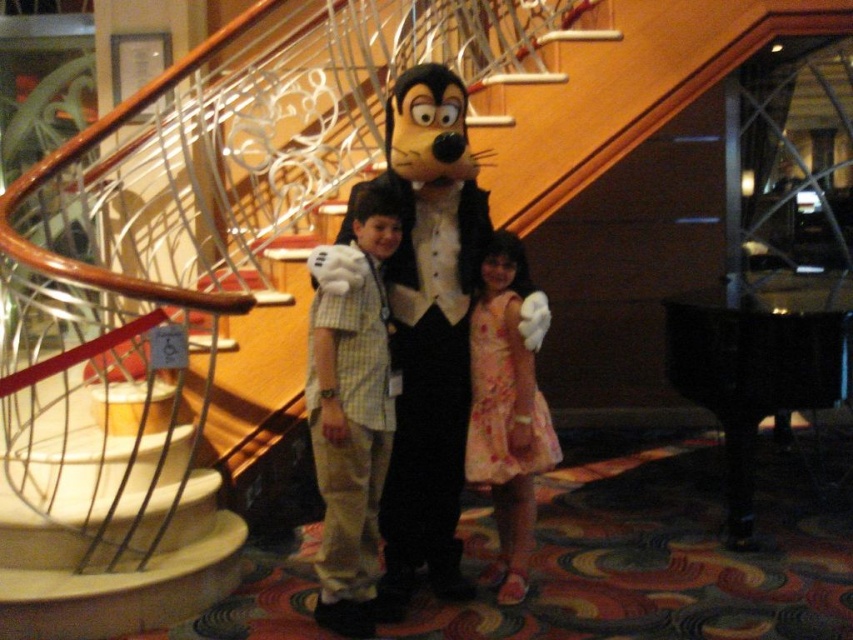
Question: Does light brown cotton pants at center have a larger size compared to floral cotton dress at center?

Choices:
 (A) yes
 (B) no

Answer: (A)

Question: Does white plush mascot at center appear on the right side of floral cotton dress at center?

Choices:
 (A) no
 (B) yes

Answer: (A)

Question: Does light brown cotton pants at center have a lesser width compared to floral cotton dress at center?

Choices:
 (A) no
 (B) yes

Answer: (B)

Question: Which of these objects is positioned farthest from the light brown cotton pants at center?

Choices:
 (A) white plush mascot at center
 (B) floral cotton dress at center

Answer: (B)

Question: Which point appears closest to the camera in this image?

Choices:
 (A) (439, 172)
 (B) (492, 285)
 (C) (367, 333)

Answer: (C)

Question: Which point is farther from the camera taking this photo?

Choices:
 (A) (488, 449)
 (B) (363, 522)

Answer: (A)